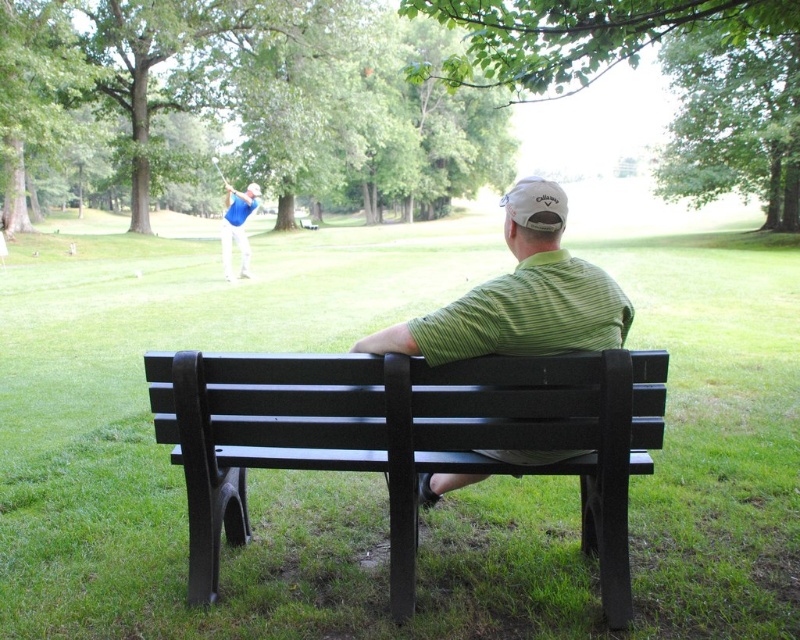
You are a gardener who needs to mow the lawn. You see the green grass at center and the black plastic bench at center. Which object should you avoid mowing?

You should avoid mowing the black plastic bench at center because the green grass at center is much taller and requires mowing, while the bench is an object and not grass.

You are standing at the point labeled as point (254, 470). What is the terrain type under your feet?

The terrain under your feet at point (254, 470) is green grass at center.